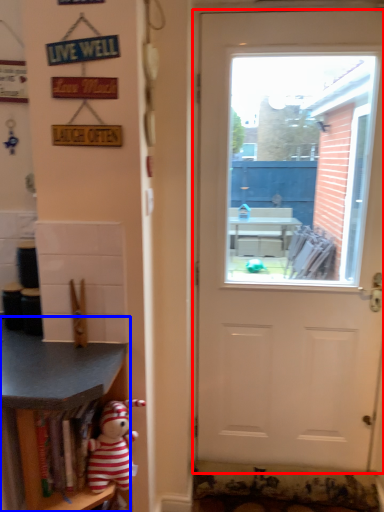
Question: Which object is further to the camera taking this photo, door (highlighted by a red box) or shelf (highlighted by a blue box)?

Choices:
 (A) door
 (B) shelf

Answer: (A)